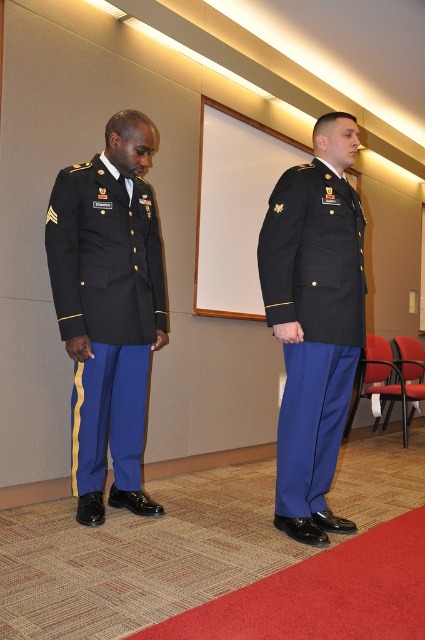
You are observing two individuals in a military setting. The scene includes a matte black uniform at left and a matte black uniform at center. Which of these two uniforms is shorter in height?

The matte black uniform at left is shorter in height compared to the matte black uniform at center.

You are a photographer positioned in front of the two individuals in the scene. You need to capture a photo that includes both the matte black uniform at left and the matte black uniform at center. Which individual should you adjust your camera angle to focus on first to ensure both are in frame?

You should focus on the matte black uniform at center first because the matte black uniform at left is closer to you, so adjusting the camera to include them might naturally bring the center individual into the frame as well.

Consider the image. You are a military photographer tasked with capturing a group photo of the matte black uniform at left and the matte black uniform at center. Since you want both individuals to appear equally sized in the photo, which adjustment should you make to your camera setup?

To make the matte black uniform at left and the matte black uniform at center appear equally sized in the photo, you should move the camera closer to the matte black uniform at center, as it is smaller in size and needs to be magnified to match the size of the matte black uniform at left.